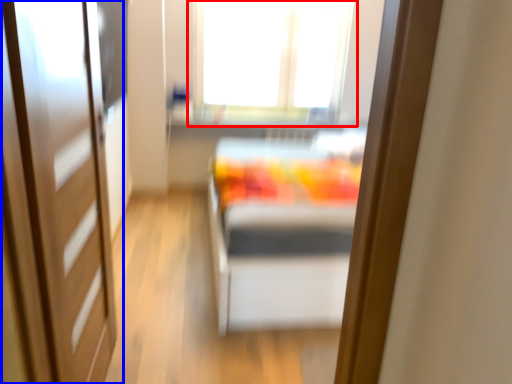
Question: Which point is further to the camera, window (highlighted by a red box) or door (highlighted by a blue box)?

Choices:
 (A) window
 (B) door

Answer: (A)